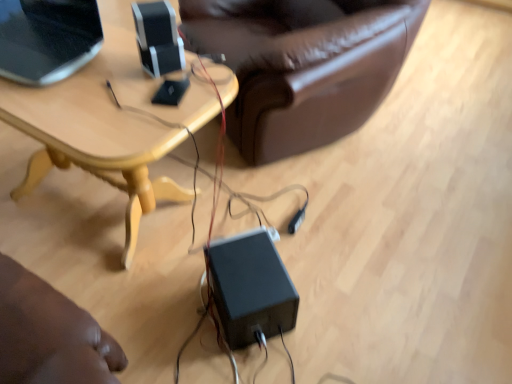
At what (x,y) coordinates should I click in order to perform the action: click on vacant area located to the right-hand side of matte black laptop at upper left. Please return your answer as a coordinate pair (x, y). This screenshot has width=512, height=384. Looking at the image, I should click on (119, 73).